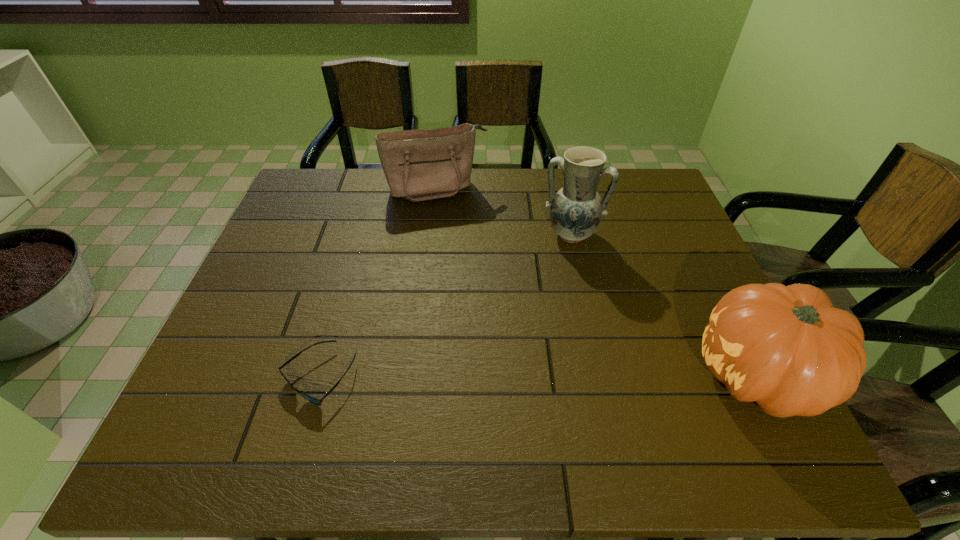
This screenshot has width=960, height=540. I want to click on sunglasses, so click(313, 400).

Identify the location of the rightmost object. This screenshot has width=960, height=540. (786, 347).

Where is `the second farthest object`? This screenshot has width=960, height=540. the second farthest object is located at coordinates (576, 210).

Find the location of a particular element. The image size is (960, 540). pottery is located at coordinates (576, 210).

The width and height of the screenshot is (960, 540). I want to click on shoulder bag, so click(x=419, y=165).

I want to click on vacant space located on the carved face of the pumpkin, so click(553, 376).

Locate an element on the screen. vacant region located 0.320m on the carved face of the pumpkin is located at coordinates (543, 376).

Locate an element on the screen. vacant space located 0.140m on the carved face of the pumpkin is located at coordinates (627, 376).

At what (x,y) coordinates should I click in order to perform the action: click on blank space located 0.280m on either side of the second object from right to left. Please return your answer as a coordinate pair (x, y). This screenshot has width=960, height=540. Looking at the image, I should click on (542, 326).

Locate an element on the screen. This screenshot has width=960, height=540. free space located 0.280m on either side of the second object from right to left is located at coordinates (542, 326).